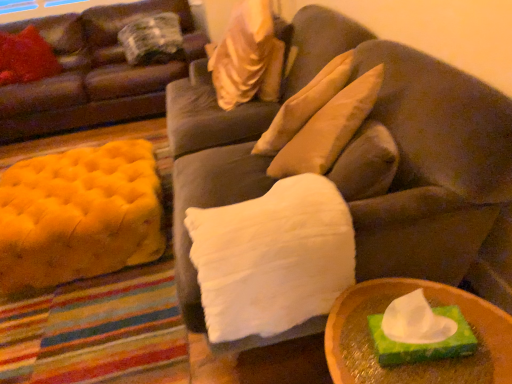
Question: Does wooden tray at lower right appear on the left side of plaid fabric pillow at upper left, placed as the third pillow when sorted from right to left?

Choices:
 (A) yes
 (B) no

Answer: (B)

Question: Can you confirm if wooden tray at lower right is smaller than plaid fabric pillow at upper left, the 4th pillow in the front-to-back sequence?

Choices:
 (A) yes
 (B) no

Answer: (A)

Question: From the image's perspective, is wooden tray at lower right below plaid fabric pillow at upper left, the 4th pillow in the front-to-back sequence?

Choices:
 (A) yes
 (B) no

Answer: (A)

Question: Considering the relative sizes of wooden tray at lower right and plaid fabric pillow at upper left, placed as the third pillow when sorted from right to left, in the image provided, is wooden tray at lower right bigger than plaid fabric pillow at upper left, placed as the third pillow when sorted from right to left,?

Choices:
 (A) no
 (B) yes

Answer: (A)

Question: Does wooden tray at lower right lie in front of plaid fabric pillow at upper left, placed as the third pillow when sorted from right to left?

Choices:
 (A) yes
 (B) no

Answer: (A)

Question: Looking at their shapes, would you say satin beige pillow at upper center, positioned as the 3th pillow in left-to-right order, is wider or thinner than wooden tray at lower right?

Choices:
 (A) wide
 (B) thin

Answer: (A)

Question: From their relative heights in the image, would you say satin beige pillow at upper center, marked as the 2th pillow in a front-to-back arrangement, is taller or shorter than wooden tray at lower right?

Choices:
 (A) tall
 (B) short

Answer: (A)

Question: Do you think satin beige pillow at upper center, marked as the 2th pillow in a front-to-back arrangement, is within wooden tray at lower right, or outside of it?

Choices:
 (A) outside
 (B) inside

Answer: (A)

Question: From a real-world perspective, relative to wooden tray at lower right, is satin beige pillow at upper center, which is the 2th pillow in right-to-left order, vertically above or below?

Choices:
 (A) above
 (B) below

Answer: (A)

Question: Visually, is velvety red pillow at upper left, marked as the 1th pillow in a left-to-right arrangement, positioned to the left or to the right of wooden tray at lower right?

Choices:
 (A) right
 (B) left

Answer: (B)

Question: From the image's perspective, relative to wooden tray at lower right, is velvety red pillow at upper left, which is the fourth pillow in right-to-left order, above or below?

Choices:
 (A) above
 (B) below

Answer: (A)

Question: Is velvety red pillow at upper left, the second pillow in the back-to-front sequence, situated inside wooden tray at lower right or outside?

Choices:
 (A) outside
 (B) inside

Answer: (A)

Question: From a real-world perspective, relative to wooden tray at lower right, is velvety red pillow at upper left, the second pillow in the back-to-front sequence, vertically above or below?

Choices:
 (A) below
 (B) above

Answer: (B)

Question: Considering the positions of white fluffy pillow at center, placed as the 4th pillow when sorted from back to front, and velvety red pillow at upper left, the second pillow in the back-to-front sequence, in the image, is white fluffy pillow at center, placed as the 4th pillow when sorted from back to front, bigger or smaller than velvety red pillow at upper left, the second pillow in the back-to-front sequence,?

Choices:
 (A) big
 (B) small

Answer: (A)

Question: Choose the correct answer: Is white fluffy pillow at center, which is the 1th pillow in right-to-left order, inside velvety red pillow at upper left, which is counted as the 3th pillow, starting from the front, or outside it?

Choices:
 (A) inside
 (B) outside

Answer: (B)